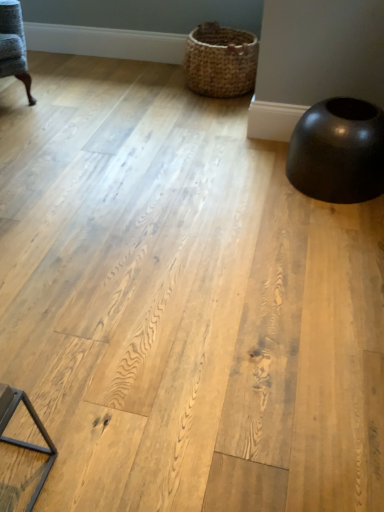
Locate an element on the screen. The image size is (384, 512). free space to the left of woven brown basket at upper center is located at coordinates (146, 83).